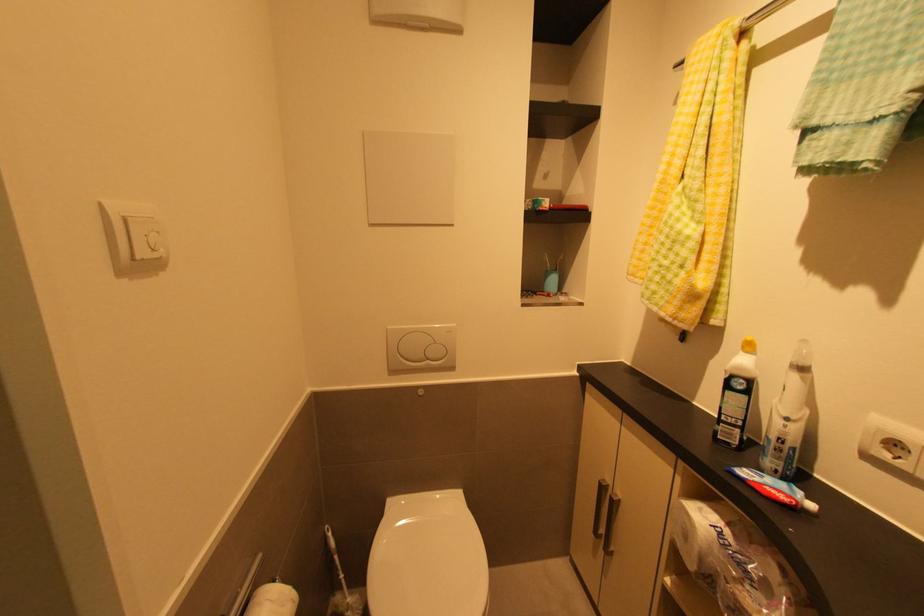
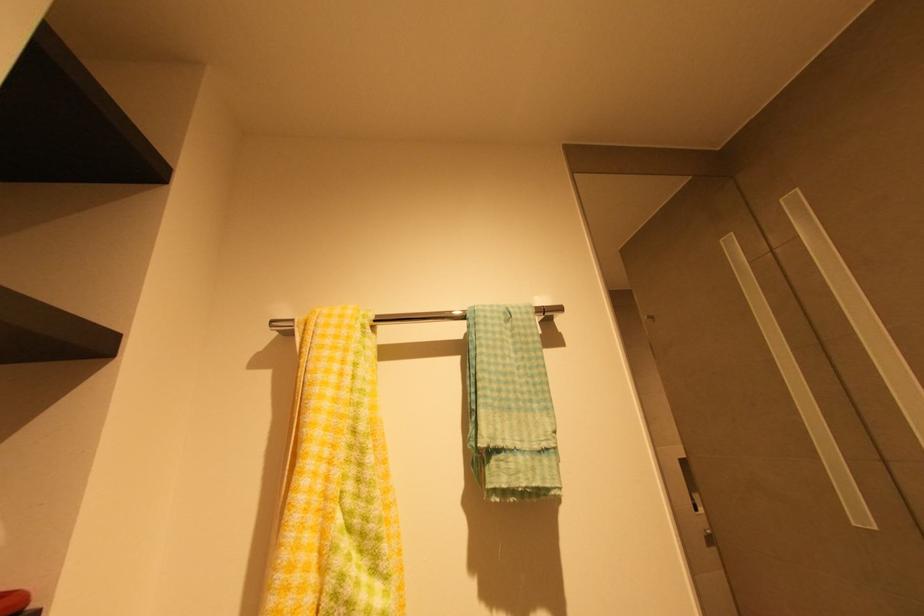
The images are taken continuously from a first-person perspective. In which direction is your viewpoint rotating?

The camera rotated toward right-up.